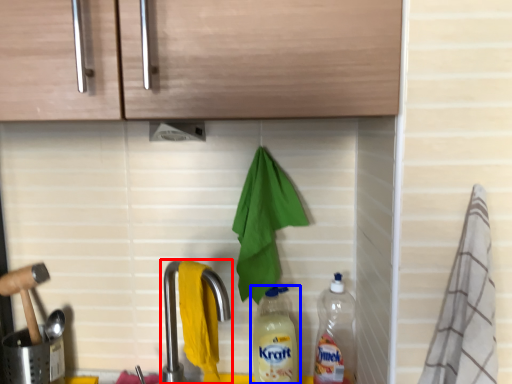
Question: Which object is further to the camera taking this photo, tap (highlighted by a red box) or bottle (highlighted by a blue box)?

Choices:
 (A) tap
 (B) bottle

Answer: (B)